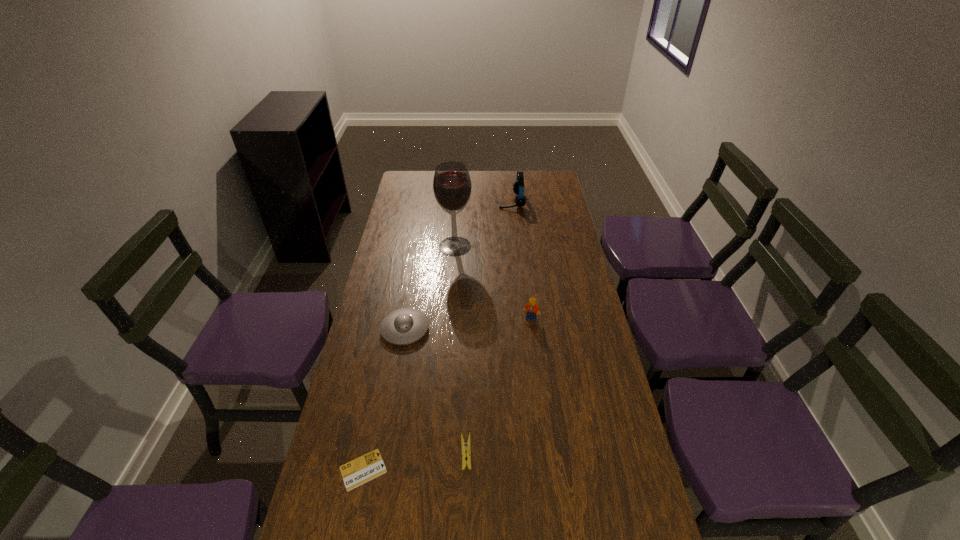
Find the location of a particular element. vacant area that lies between the third shortest object and the identity card is located at coordinates (384, 400).

Select which object appears as the third closest to the clothespin. Please provide its 2D coordinates. Your answer should be formatted as a tuple, i.e. [(x, y)], where the tuple contains the x and y coordinates of a point satisfying the conditions above.

[(532, 309)]

Locate which object ranks in proximity to the alcohol. Please provide its 2D coordinates. Your answer should be formatted as a tuple, i.e. [(x, y)], where the tuple contains the x and y coordinates of a point satisfying the conditions above.

[(518, 187)]

The width and height of the screenshot is (960, 540). In order to click on free space in the image that satisfies the following two spatial constraints: 1. on the back side of the shortest object; 2. on the right side of the tallest object in this screenshot , I will do (x=408, y=246).